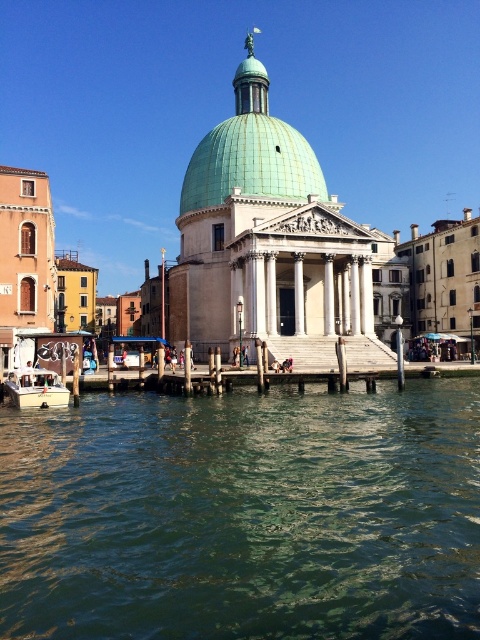
Question: Which point appears farthest from the camera in this image?

Choices:
 (A) click(36, 369)
 (B) click(72, 460)
 (C) click(271, 172)

Answer: (C)

Question: Can you confirm if greenish water at center is smaller than green glazed dome at center?

Choices:
 (A) no
 (B) yes

Answer: (B)

Question: Is greenish water at center thinner than green glazed dome at center?

Choices:
 (A) yes
 (B) no

Answer: (B)

Question: Among these points, which one is farthest from the camera?

Choices:
 (A) (337, 420)
 (B) (284, 193)
 (C) (44, 404)

Answer: (B)

Question: Can you confirm if greenish water at center is positioned to the right of white plastic boat at lower left?

Choices:
 (A) yes
 (B) no

Answer: (A)

Question: Which is nearer to the green glazed dome at center?

Choices:
 (A) greenish water at center
 (B) white plastic boat at lower left

Answer: (B)